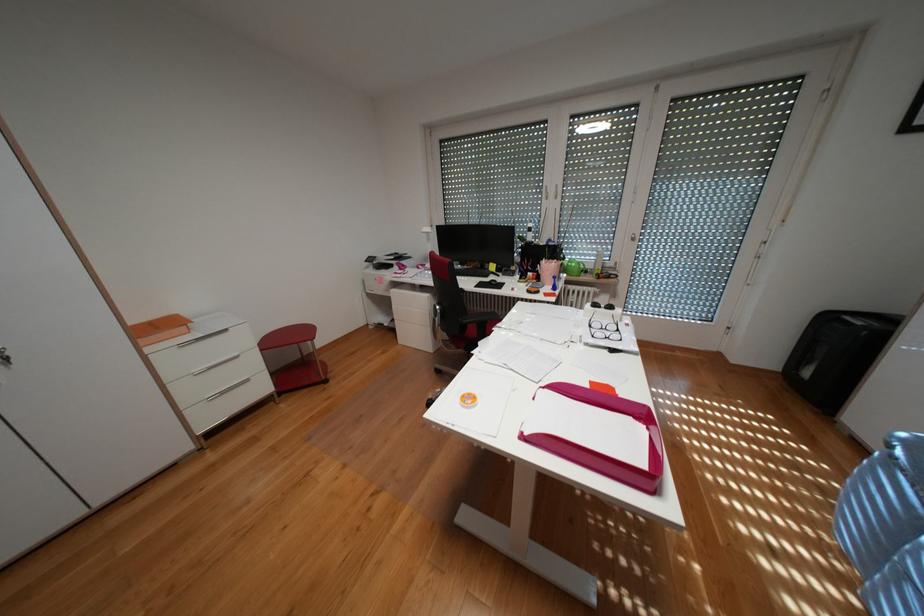
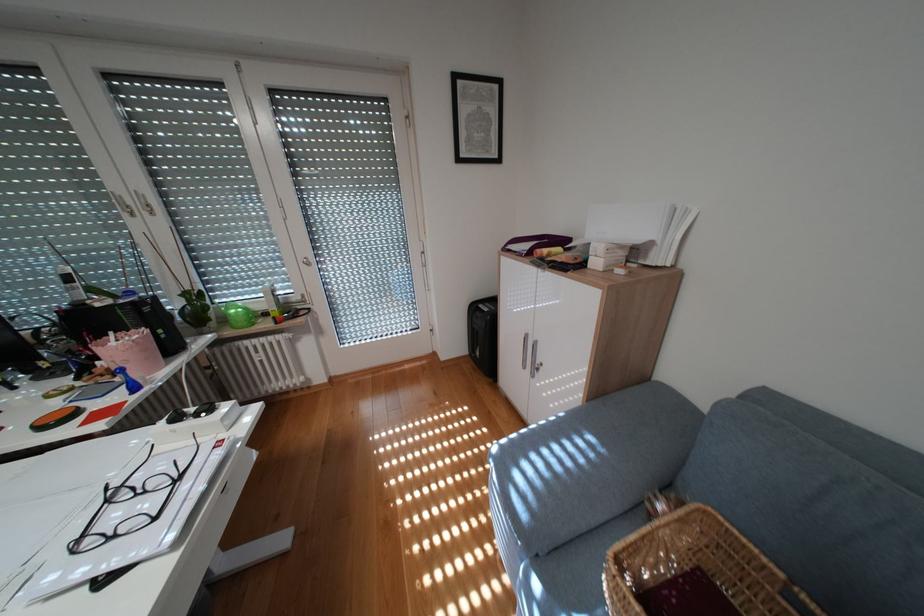
In the second image, find the point that corresponds to the point at 561,265 in the first image.

(136, 345)